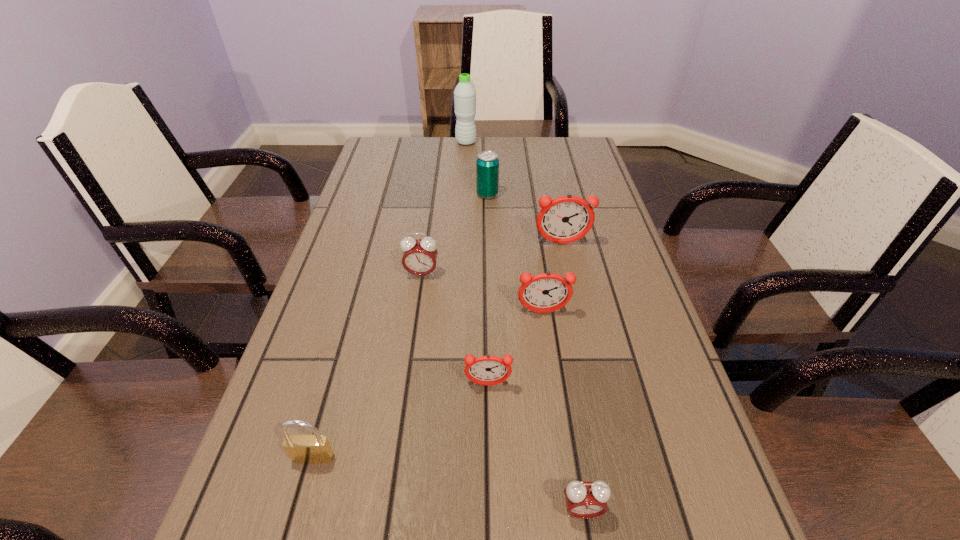
Locate an element on the screen. This screenshot has width=960, height=540. the tallest object is located at coordinates (464, 94).

You are a GUI agent. You are given a task and a screenshot of the screen. Output one action in this format:
    pyautogui.click(x=<x>, y=<y>)
    Task: Click on the farthest object
    The height and width of the screenshot is (540, 960).
    Given the screenshot: What is the action you would take?
    pyautogui.click(x=464, y=94)

Locate an element on the screen. The height and width of the screenshot is (540, 960). the second tallest object is located at coordinates (566, 219).

In order to click on the farthest reddish-pink alarm clock in this screenshot , I will do `click(566, 219)`.

Locate an element on the screen. The height and width of the screenshot is (540, 960). beer can is located at coordinates pos(487,164).

Locate an element on the screen. The height and width of the screenshot is (540, 960). teal beer can is located at coordinates (487, 164).

This screenshot has width=960, height=540. I want to click on the bigger pink alarm clock, so click(x=419, y=258).

Image resolution: width=960 pixels, height=540 pixels. Find the location of `the leftmost alarm clock`. the leftmost alarm clock is located at coordinates (419, 258).

The height and width of the screenshot is (540, 960). I want to click on the second smallest reddish-pink alarm clock, so click(x=547, y=292).

Where is `the second farthest reddish-pink alarm clock`? the second farthest reddish-pink alarm clock is located at coordinates (547, 292).